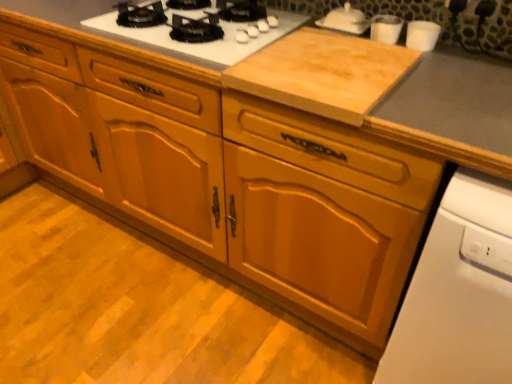
What are the coordinates of `free space to the left of white glossy teapot at upper right, arranged as the third appliance when viewed from the right` in the screenshot? It's located at 288,27.